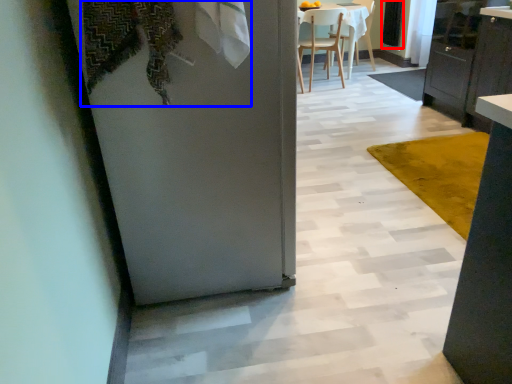
Question: Which object is further to the camera taking this photo, screen door (highlighted by a red box) or laundry (highlighted by a blue box)?

Choices:
 (A) screen door
 (B) laundry

Answer: (A)